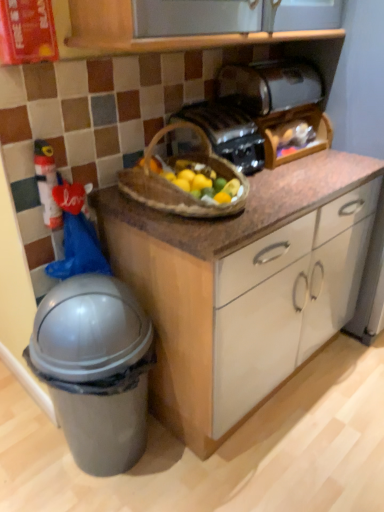
Question: Can you confirm if satin black toaster at upper center, acting as the 2th toaster starting from the bottom, is positioned to the right of matte black toaster at center, the 2th toaster when ordered from top to bottom?

Choices:
 (A) yes
 (B) no

Answer: (A)

Question: From the image's perspective, does satin black toaster at upper center, marked as the first toaster in a top-to-bottom arrangement, appear lower than matte black toaster at center, the 2th toaster when ordered from top to bottom?

Choices:
 (A) no
 (B) yes

Answer: (A)

Question: Considering the relative sizes of satin black toaster at upper center, marked as the first toaster in a top-to-bottom arrangement, and matte black toaster at center, the 2th toaster when ordered from top to bottom, in the image provided, is satin black toaster at upper center, marked as the first toaster in a top-to-bottom arrangement, bigger than matte black toaster at center, the 2th toaster when ordered from top to bottom,?

Choices:
 (A) no
 (B) yes

Answer: (B)

Question: Is satin black toaster at upper center, marked as the first toaster in a top-to-bottom arrangement, oriented away from matte black toaster at center, the 2th toaster when ordered from top to bottom?

Choices:
 (A) yes
 (B) no

Answer: (B)

Question: Is satin black toaster at upper center, acting as the 2th toaster starting from the bottom, outside of matte black toaster at center, the 1th toaster from the bottom?

Choices:
 (A) yes
 (B) no

Answer: (A)

Question: Is satin black toaster at upper center, acting as the 2th toaster starting from the bottom, wider than matte black toaster at center, the 2th toaster when ordered from top to bottom?

Choices:
 (A) no
 (B) yes

Answer: (A)

Question: Is plastic fire extinguisher at left with gray plastic trash can at lower left?

Choices:
 (A) yes
 (B) no

Answer: (B)

Question: Is the depth of plastic fire extinguisher at left greater than that of gray plastic trash can at lower left?

Choices:
 (A) yes
 (B) no

Answer: (A)

Question: Is the position of plastic fire extinguisher at left less distant than that of gray plastic trash can at lower left?

Choices:
 (A) yes
 (B) no

Answer: (B)

Question: From a real-world perspective, is plastic fire extinguisher at left positioned over gray plastic trash can at lower left based on gravity?

Choices:
 (A) yes
 (B) no

Answer: (A)

Question: Is plastic fire extinguisher at left to the left of gray plastic trash can at lower left from the viewer's perspective?

Choices:
 (A) yes
 (B) no

Answer: (A)

Question: Does plastic fire extinguisher at left have a smaller size compared to gray plastic trash can at lower left?

Choices:
 (A) yes
 (B) no

Answer: (A)

Question: Can you confirm if matte black toaster at center, the 2th toaster when ordered from top to bottom, is taller than satin black toaster at upper center, marked as the first toaster in a top-to-bottom arrangement?

Choices:
 (A) yes
 (B) no

Answer: (A)